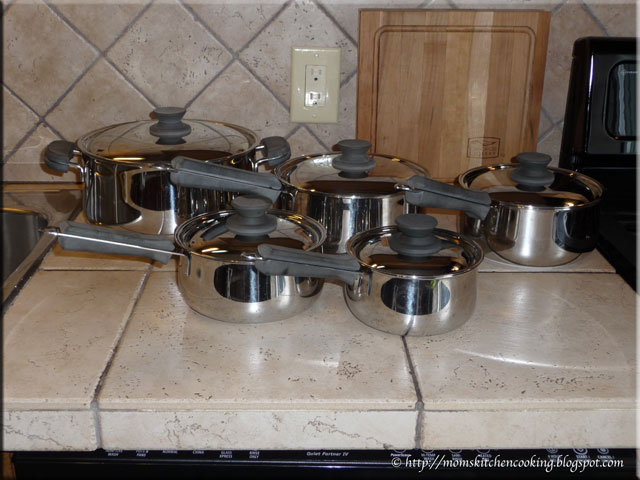
Identify the location of tile. The image size is (640, 480). (463, 415).